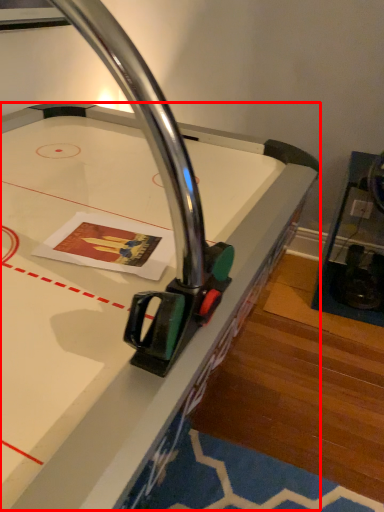
Question: From the image's perspective, where is table (annotated by the red box) located relative to furniture?

Choices:
 (A) above
 (B) below

Answer: (B)